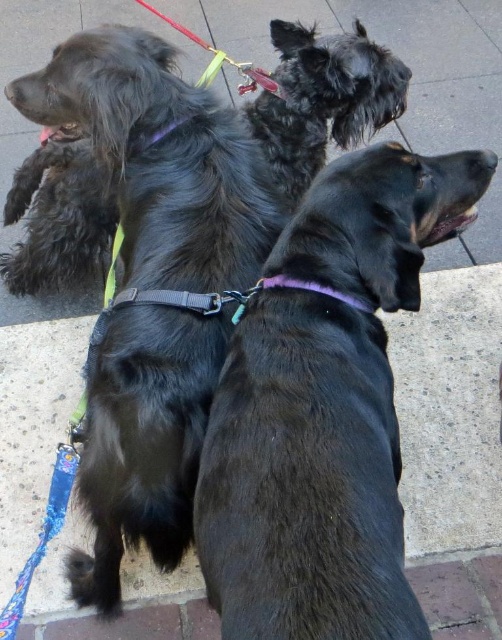
Is black matte dog at center positioned behind purple fabric neckband at center?

No, it is in front of purple fabric neckband at center.

Can you confirm if black matte dog at center is positioned below purple fabric neckband at center?

Indeed, black matte dog at center is positioned under purple fabric neckband at center.

Where is `black matte dog at center`? black matte dog at center is located at coordinates (305, 477).

You are a GUI agent. You are given a task and a screenshot of the screen. Output one action in this format:
    pyautogui.click(x=<x>, y=<y>)
    Task: Click on the black matte dog at center
    The image size is (502, 640).
    Given the screenshot: What is the action you would take?
    pyautogui.click(x=305, y=477)

Who is more forward, (x=205, y=77) or (x=328, y=289)?

Point (x=328, y=289)

Does yellow fabric leash at upper center appear on the right side of purple fabric neckband at center?

No, yellow fabric leash at upper center is not to the right of purple fabric neckband at center.

Based on the photo, who is more forward, (266, 81) or (333, 292)?

Positioned in front is point (333, 292).

Locate an element on the screen. Image resolution: width=502 pixels, height=640 pixels. yellow fabric leash at upper center is located at coordinates (222, 60).

Who is positioned more to the right, black matte dog at center or yellow fabric leash at upper center?

From the viewer's perspective, black matte dog at center appears more on the right side.

This screenshot has height=640, width=502. Find the location of `black matte dog at center`. black matte dog at center is located at coordinates (305, 477).

What do you see at coordinates (305, 477) in the screenshot?
I see `black matte dog at center` at bounding box center [305, 477].

Locate an element on the screen. This screenshot has width=502, height=640. black matte dog at center is located at coordinates (305, 477).